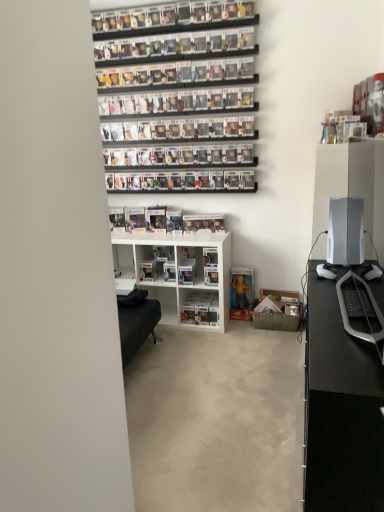
Image resolution: width=384 pixels, height=512 pixels. What are the coordinates of `blank space situated above white glossy desktop at right (from a real-world perspective)` in the screenshot? It's located at (349, 196).